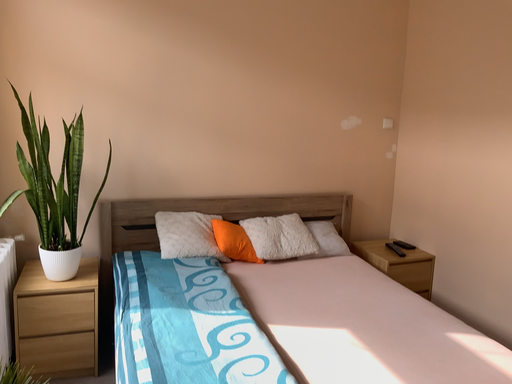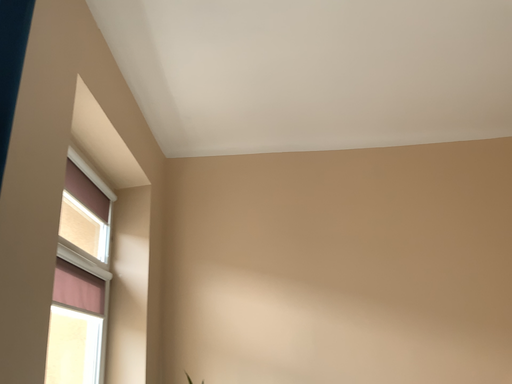
Question: How did the camera likely rotate when shooting the video?

Choices:
 (A) rotated left
 (B) rotated right

Answer: (A)